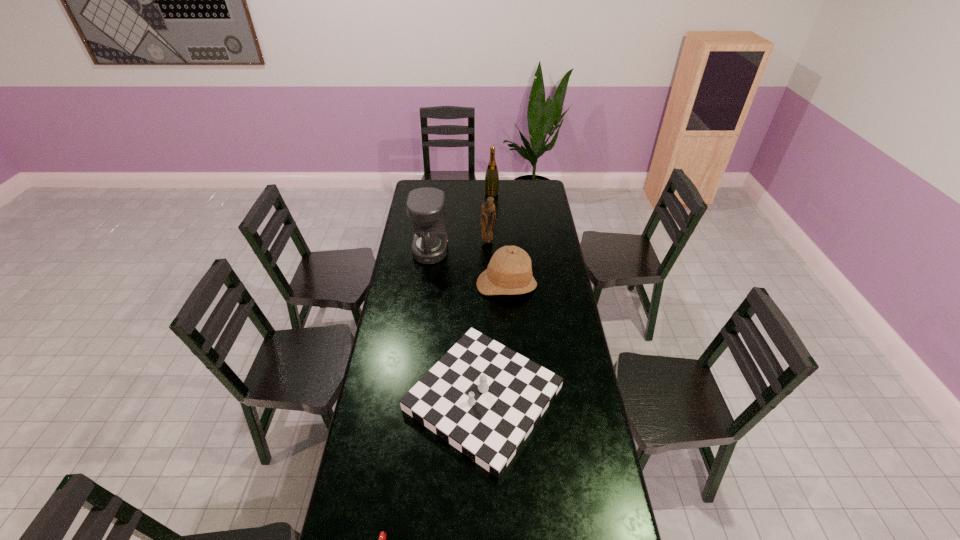
The image size is (960, 540). What are the coordinates of `coffee maker` in the screenshot? It's located at (425, 206).

Locate an element on the screen. Image resolution: width=960 pixels, height=540 pixels. the farthest object is located at coordinates coord(492,176).

This screenshot has width=960, height=540. I want to click on figurine, so click(487, 210).

You are a GUI agent. You are given a task and a screenshot of the screen. Output one action in this format:
    pyautogui.click(x=<x>, y=<y>)
    Task: Click on the hat
    
    Given the screenshot: What is the action you would take?
    pyautogui.click(x=509, y=272)

At what (x,y) coordinates should I click in order to perform the action: click on the fourth farthest object. Please return your answer as a coordinate pair (x, y). Image resolution: width=960 pixels, height=540 pixels. Looking at the image, I should click on pyautogui.click(x=509, y=272).

Where is `the second nearest object`? This screenshot has height=540, width=960. the second nearest object is located at coordinates (483, 398).

This screenshot has height=540, width=960. Identify the location of the second shortest object. (483, 398).

Locate an element on the screen. This screenshot has height=540, width=960. free space located 0.170m on the button side of the coffee maker is located at coordinates (480, 251).

Locate an element on the screen. The image size is (960, 540). vacant space located 0.160m on the front-facing side of the wine bottle is located at coordinates (492, 212).

This screenshot has height=540, width=960. Find the location of `vacant space situated on the front-facing side of the figurine`. vacant space situated on the front-facing side of the figurine is located at coordinates tap(488, 252).